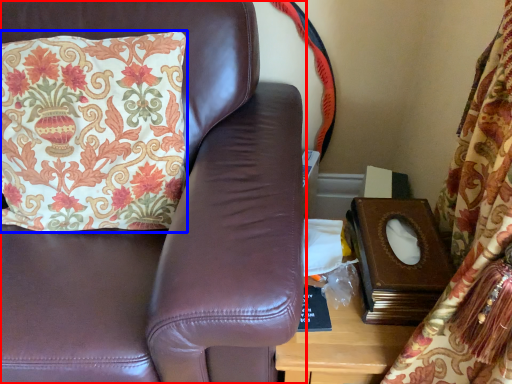
Question: Which object is closer to the camera taking this photo, furniture (highlighted by a red box) or pillow (highlighted by a blue box)?

Choices:
 (A) furniture
 (B) pillow

Answer: (A)